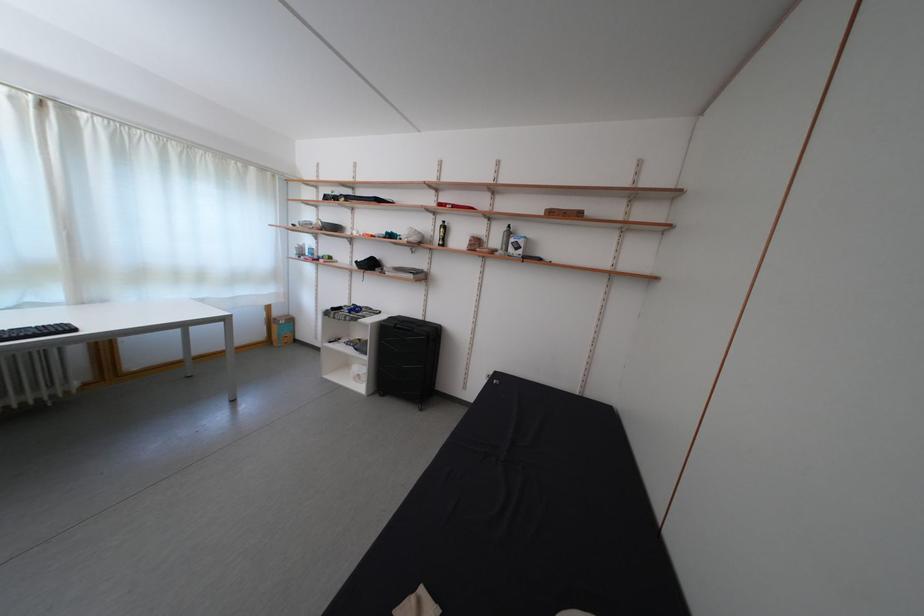
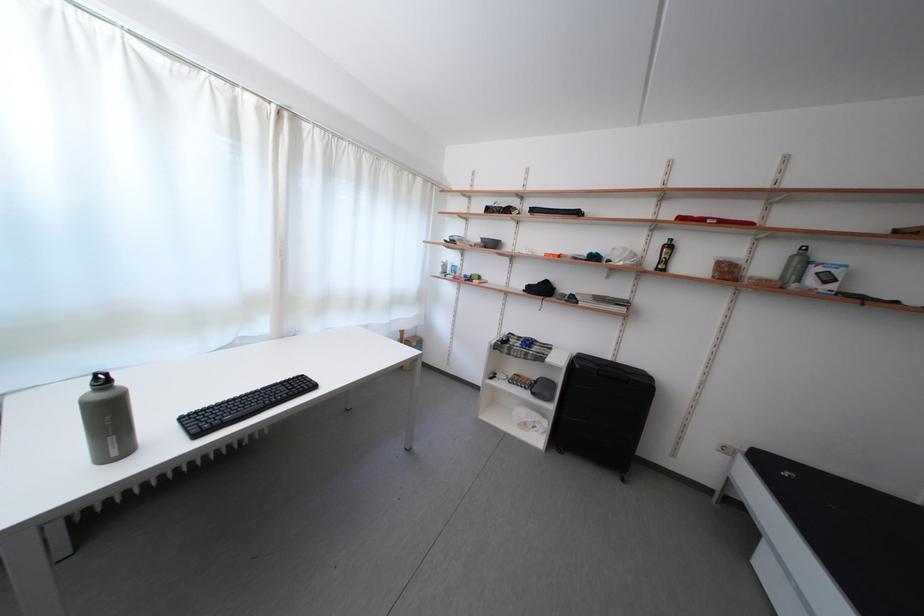
The point at (430, 323) is marked in the first image. Where is the corresponding point in the second image?

(617, 363)